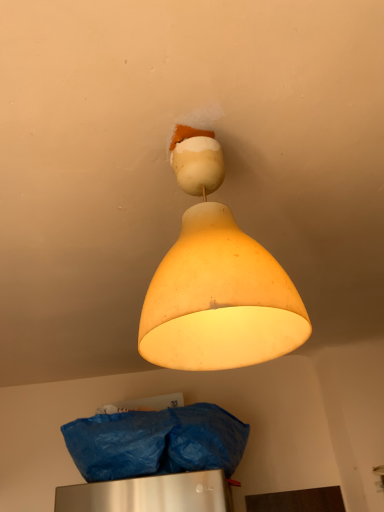
The height and width of the screenshot is (512, 384). What do you see at coordinates (156, 442) in the screenshot?
I see `blue plastic bag at lower center` at bounding box center [156, 442].

The image size is (384, 512). I want to click on blue plastic bag at lower center, so click(156, 442).

What is the approximate height of matte yellow lampshade at upper center?

The height of matte yellow lampshade at upper center is 19.37 inches.

This screenshot has width=384, height=512. What are the coordinates of `matte yellow lampshade at upper center` in the screenshot? It's located at (216, 281).

This screenshot has height=512, width=384. What do you see at coordinates (216, 281) in the screenshot?
I see `matte yellow lampshade at upper center` at bounding box center [216, 281].

At what (x,y) coordinates should I click in order to perform the action: click on blue plastic bag at lower center. Please return your answer as a coordinate pair (x, y). This screenshot has height=512, width=384. Looking at the image, I should click on (156, 442).

Between blue plastic bag at lower center and matte yellow lampshade at upper center, which one appears on the left side from the viewer's perspective?

blue plastic bag at lower center.

Which object is closer to the camera taking this photo, blue plastic bag at lower center or matte yellow lampshade at upper center?

matte yellow lampshade at upper center.

Considering the positions of point (173, 435) and point (211, 284), is point (173, 435) closer or farther from the camera than point (211, 284)?

Point (173, 435) appears to be farther away from the viewer than point (211, 284).

From the image's perspective, between blue plastic bag at lower center and matte yellow lampshade at upper center, who is located below?

blue plastic bag at lower center appears lower in the image.

From a real-world perspective, is blue plastic bag at lower center under matte yellow lampshade at upper center?

Yes, from a real-world perspective, blue plastic bag at lower center is under matte yellow lampshade at upper center.

Between blue plastic bag at lower center and matte yellow lampshade at upper center, which one has smaller width?

matte yellow lampshade at upper center.

Considering the sizes of blue plastic bag at lower center and matte yellow lampshade at upper center in the image, is blue plastic bag at lower center taller or shorter than matte yellow lampshade at upper center?

Considering their sizes, blue plastic bag at lower center has less height than matte yellow lampshade at upper center.

Considering the relative sizes of blue plastic bag at lower center and matte yellow lampshade at upper center in the image provided, is blue plastic bag at lower center bigger than matte yellow lampshade at upper center?

Yes.

Is blue plastic bag at lower center completely or partially outside of matte yellow lampshade at upper center?

Yes, blue plastic bag at lower center is located beyond the bounds of matte yellow lampshade at upper center.

Is blue plastic bag at lower center far away from matte yellow lampshade at upper center?

No, blue plastic bag at lower center is in close proximity to matte yellow lampshade at upper center.

Is blue plastic bag at lower center oriented towards matte yellow lampshade at upper center?

Yes, blue plastic bag at lower center is facing matte yellow lampshade at upper center.

At what (x,y) coordinates should I click in order to perform the action: click on lamp in front of the blue plastic bag at lower center. Please return your answer as a coordinate pair (x, y). This screenshot has width=384, height=512. Looking at the image, I should click on (216, 281).

Which is more to the left, matte yellow lampshade at upper center or blue plastic bag at lower center?

From the viewer's perspective, blue plastic bag at lower center appears more on the left side.

Which object is further away from the camera taking this photo, matte yellow lampshade at upper center or blue plastic bag at lower center?

blue plastic bag at lower center is further from the camera.

Is point (212, 348) positioned after point (119, 419)?

That is False.

From the image's perspective, which object appears higher, matte yellow lampshade at upper center or blue plastic bag at lower center?

matte yellow lampshade at upper center appears higher in the image.

From a real-world perspective, is matte yellow lampshade at upper center located higher than blue plastic bag at lower center?

Yes, from a real-world perspective, matte yellow lampshade at upper center is on top of blue plastic bag at lower center.

Considering the sizes of objects matte yellow lampshade at upper center and blue plastic bag at lower center in the image provided, who is thinner, matte yellow lampshade at upper center or blue plastic bag at lower center?

With smaller width is matte yellow lampshade at upper center.

Is matte yellow lampshade at upper center taller or shorter than blue plastic bag at lower center?

In the image, matte yellow lampshade at upper center appears to be taller than blue plastic bag at lower center.

Between matte yellow lampshade at upper center and blue plastic bag at lower center, which one has larger size?

blue plastic bag at lower center is bigger.

In the scene shown: Is matte yellow lampshade at upper center positioned beyond the bounds of blue plastic bag at lower center?

Yes, matte yellow lampshade at upper center is located beyond the bounds of blue plastic bag at lower center.

Is there a large distance between matte yellow lampshade at upper center and blue plastic bag at lower center?

They are positioned close to each other.

Could you tell me if matte yellow lampshade at upper center is facing blue plastic bag at lower center?

No, matte yellow lampshade at upper center is not facing towards blue plastic bag at lower center.

Measure the distance from matte yellow lampshade at upper center to blue plastic bag at lower center.

The distance of matte yellow lampshade at upper center from blue plastic bag at lower center is 39.08 inches.

You are a GUI agent. You are given a task and a screenshot of the screen. Output one action in this format:
    pyautogui.click(x=<x>, y=<y>)
    Task: Click on the material below the matte yellow lampshade at upper center (from the image's perspective)
    The height and width of the screenshot is (512, 384).
    Given the screenshot: What is the action you would take?
    pyautogui.click(x=156, y=442)

At what (x,y) coordinates should I click in order to perform the action: click on material on the left of matte yellow lampshade at upper center. Please return your answer as a coordinate pair (x, y). This screenshot has width=384, height=512. Looking at the image, I should click on (156, 442).

Where is `material located below the matte yellow lampshade at upper center (from the image's perspective)`? material located below the matte yellow lampshade at upper center (from the image's perspective) is located at coordinates (156, 442).